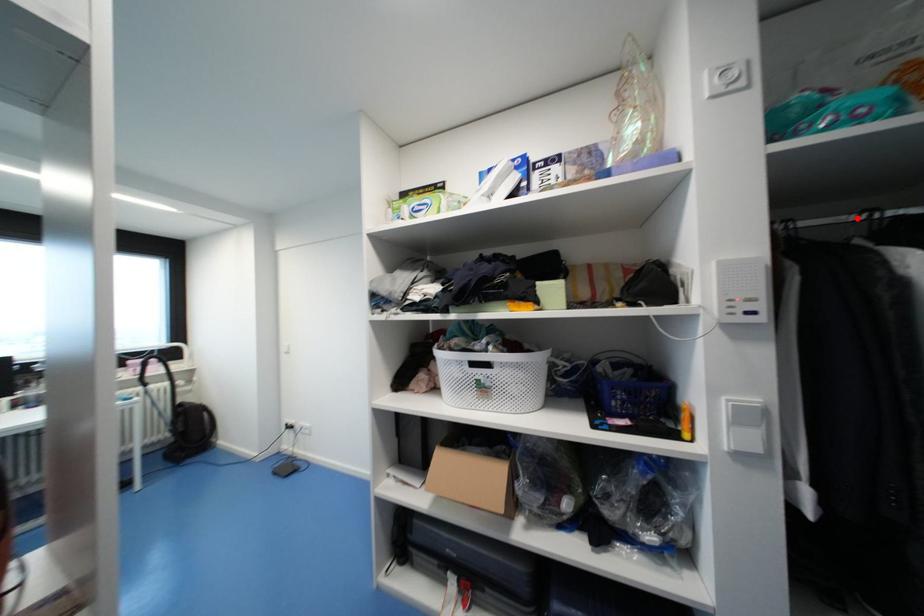
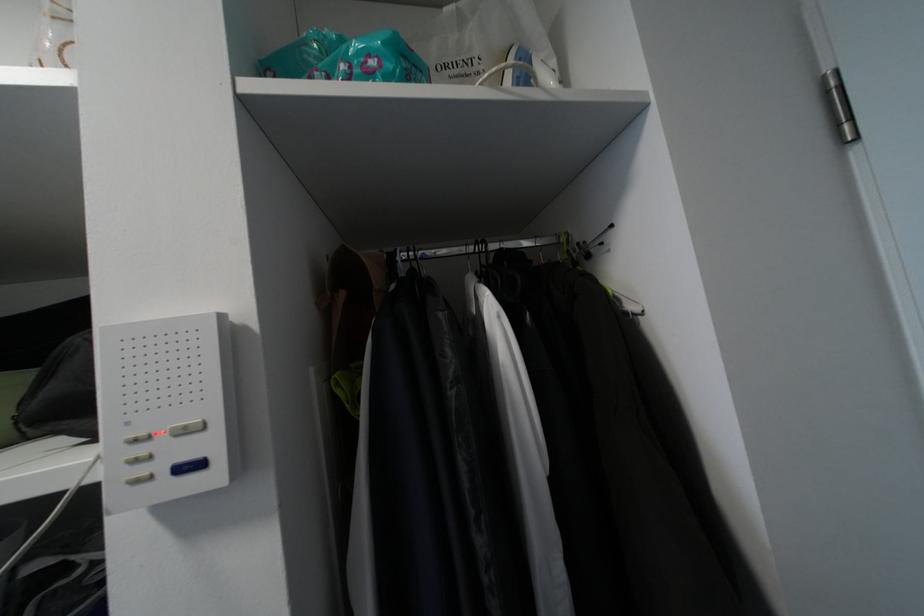
In the second image, find the point that corresponds to the highlighted location in the first image.

(476, 251)